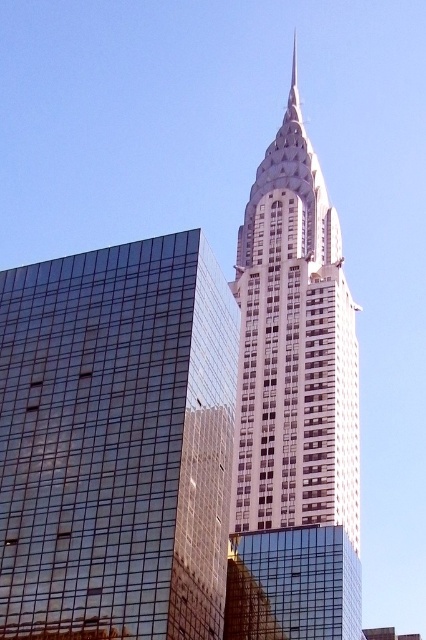
Can you confirm if glassy reflective skyscraper at center is bigger than white glass tower at center?

No, glassy reflective skyscraper at center is not bigger than white glass tower at center.

Does glassy reflective skyscraper at center have a lesser height compared to white glass tower at center?

Correct, glassy reflective skyscraper at center is not as tall as white glass tower at center.

Describe the element at coordinates (117, 442) in the screenshot. I see `glassy reflective skyscraper at center` at that location.

In order to click on glassy reflective skyscraper at center in this screenshot , I will do `click(117, 442)`.